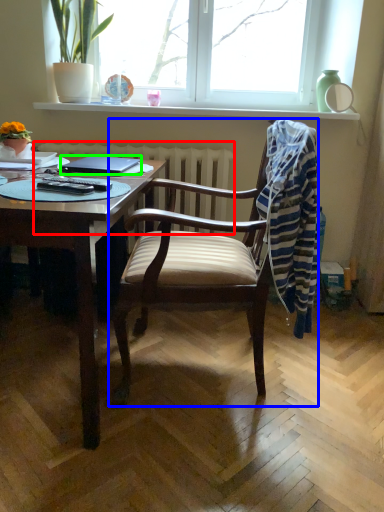
Question: Which object is positioned closest to radiator (highlighted by a red box)? Select from chair (highlighted by a blue box) and laptop (highlighted by a green box).

Choices:
 (A) chair
 (B) laptop

Answer: (B)